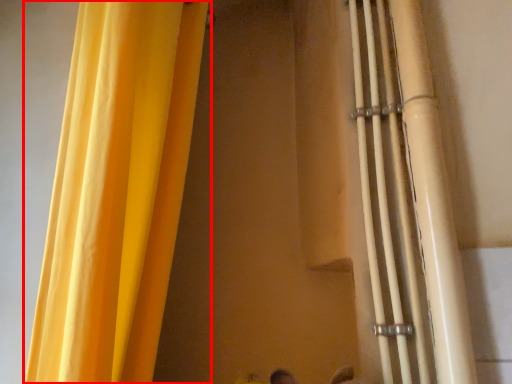
Question: From the image's perspective, where is curtain (annotated by the red box) located in relation to pipe in the image?

Choices:
 (A) below
 (B) above

Answer: (B)